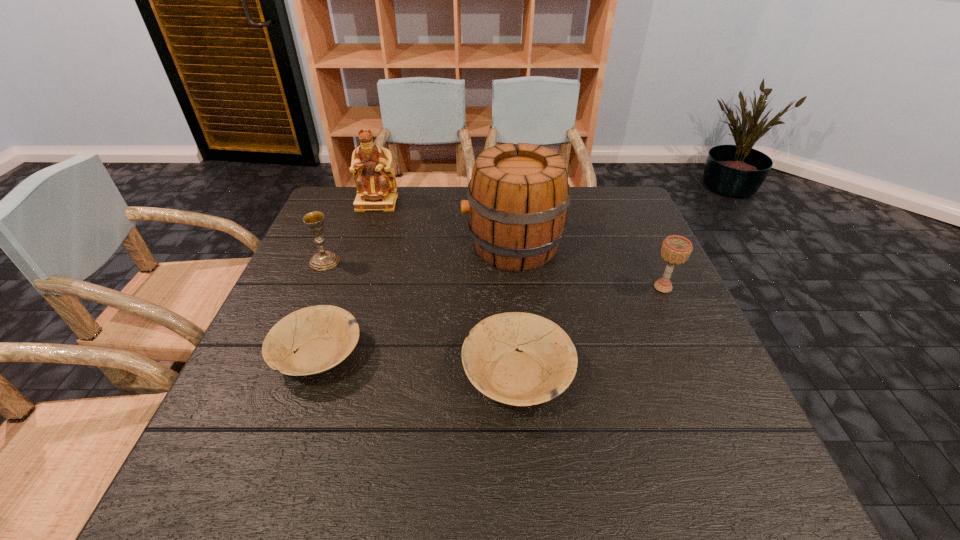
Where is `vacant space located on the left of the right bowl`? vacant space located on the left of the right bowl is located at coordinates (373, 374).

The image size is (960, 540). I want to click on vacant space located on the side of the cider where the spigot is located, so click(x=368, y=246).

You are a GUI agent. You are given a task and a screenshot of the screen. Output one action in this format:
    pyautogui.click(x=<x>, y=<y>)
    Task: Click on the free space located on the side of the cider where the spigot is located
    
    Given the screenshot: What is the action you would take?
    pyautogui.click(x=317, y=246)

The height and width of the screenshot is (540, 960). I want to click on blank area located 0.200m on the side of the cider where the spigot is located, so click(390, 246).

Where is `free space located 0.300m on the front-facing side of the farthest object`? The width and height of the screenshot is (960, 540). free space located 0.300m on the front-facing side of the farthest object is located at coordinates (352, 276).

At what (x,y) coordinates should I click in order to perform the action: click on vacant space positioned on the front of the left chalice. Please return your answer as a coordinate pair (x, y). This screenshot has width=960, height=540. Looking at the image, I should click on (273, 386).

The width and height of the screenshot is (960, 540). Identify the location of vacant space located on the front of the fourth farthest object. (711, 392).

This screenshot has width=960, height=540. I want to click on cider that is at the far edge, so click(x=518, y=198).

The width and height of the screenshot is (960, 540). I want to click on figurine that is positioned at the far edge, so click(375, 181).

Where is `object present at the near edge`? The width and height of the screenshot is (960, 540). object present at the near edge is located at coordinates (543, 367).